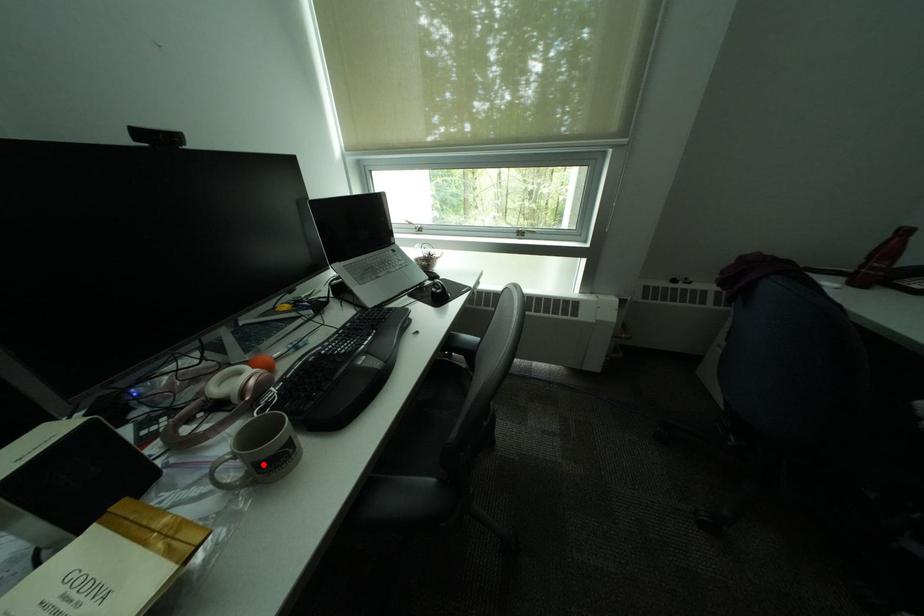
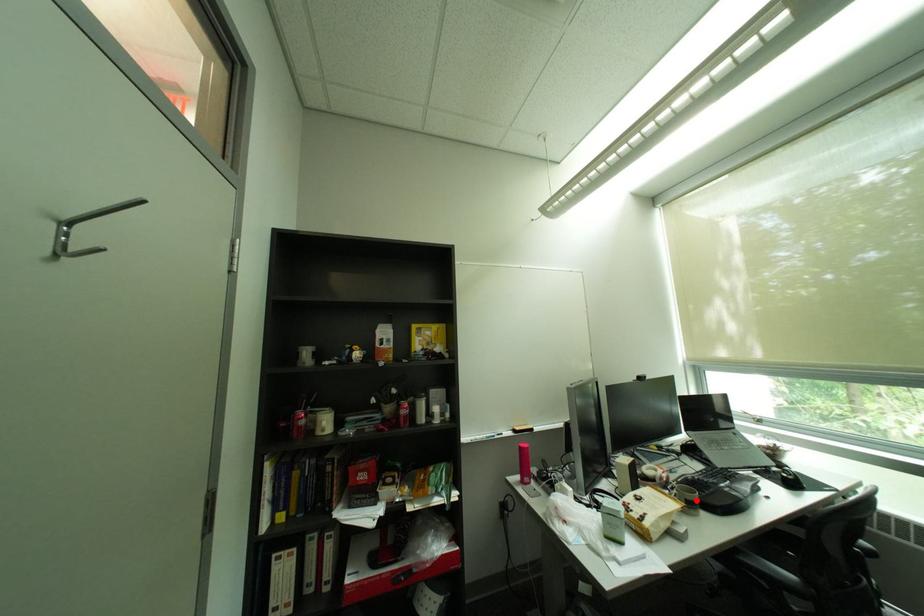
I am providing you with two images of the same scene from different viewpoints. A red point is marked on the first image and another point is marked on the second image. Does the point marked in image1 correspond to the same location as the one in image2?

Yes